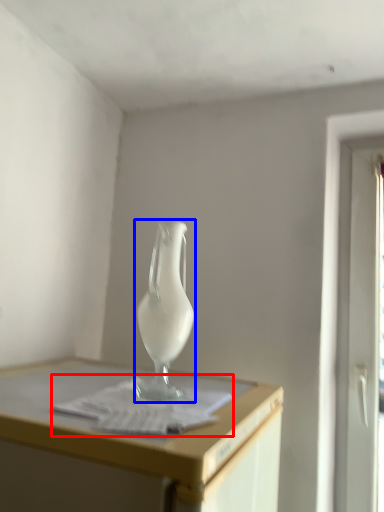
Question: Which of the following is the closest to the observer, paper (highlighted by a red box) or vase (highlighted by a blue box)?

Choices:
 (A) paper
 (B) vase

Answer: (A)